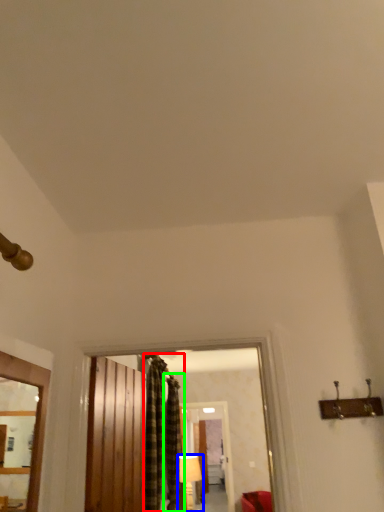
Question: Considering the real-world distances, which object is closest to curtain (highlighted by a red box)? lamp (highlighted by a blue box) or curtain (highlighted by a green box).

Choices:
 (A) lamp
 (B) curtain

Answer: (B)